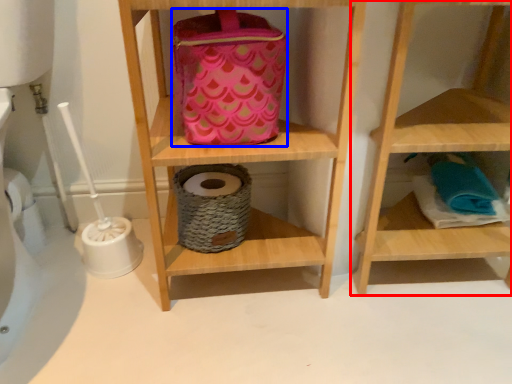
Question: Which point is further to the camera, shelf (highlighted by a red box) or pouch (highlighted by a blue box)?

Choices:
 (A) shelf
 (B) pouch

Answer: (B)